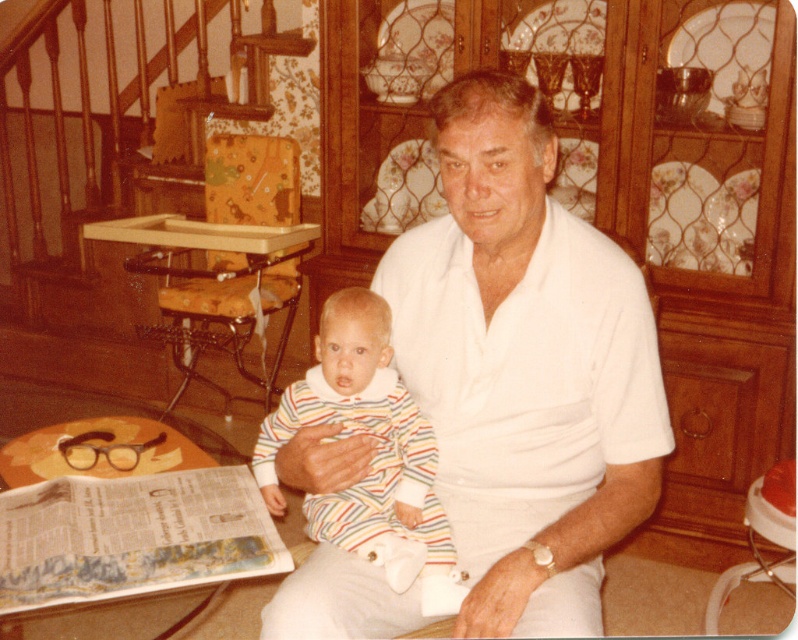
Does white cotton shirt at center have a smaller size compared to striped fabric onesie at center?

Incorrect, white cotton shirt at center is not smaller in size than striped fabric onesie at center.

Is white cotton shirt at center behind striped fabric onesie at center?

No, white cotton shirt at center is in front of striped fabric onesie at center.

Consider the image. Measure the distance between point (334, 467) and camera.

4.27 feet

At what (x,y) coordinates should I click in order to perform the action: click on white cotton shirt at center. Please return your answer as a coordinate pair (x, y). The height and width of the screenshot is (640, 798). Looking at the image, I should click on point(524,368).